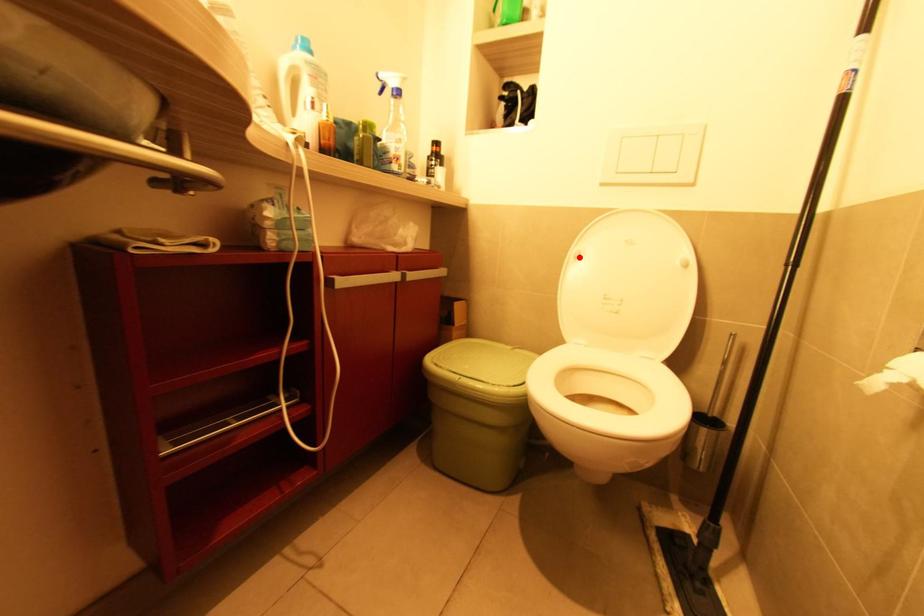
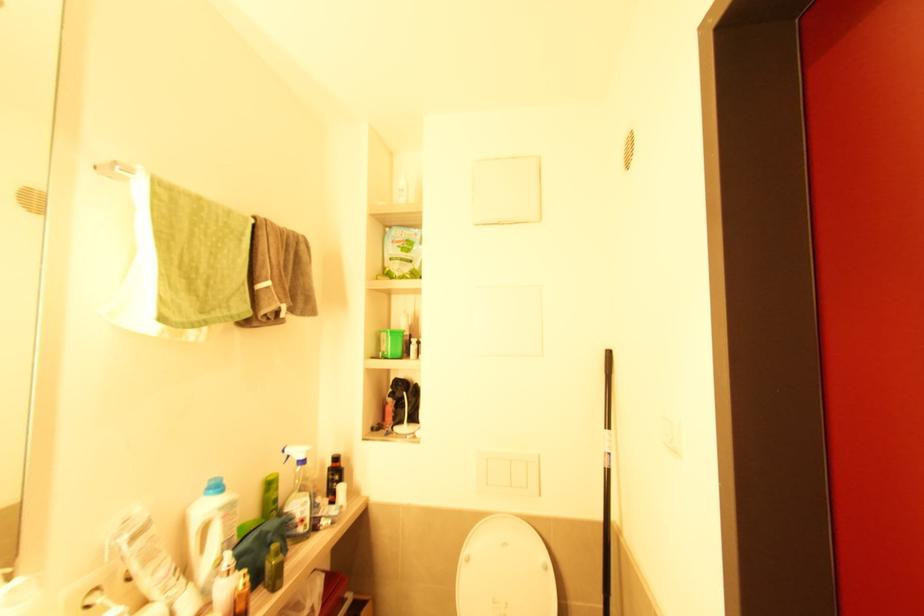
Question: I am providing you with two images of the same scene from different viewpoints. Image1 has a red point marked. In image2, the corresponding 3D location appears at what relative position? Reply with the corresponding letter.

Choices:
 (A) Closer
 (B) Farther

Answer: (B)